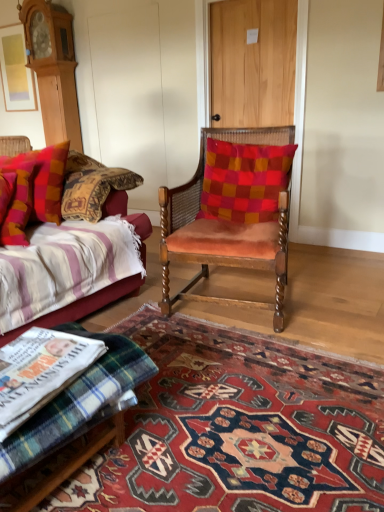
Question: Considering the relative sizes of carpet with intricate patterns at center and light brown wooden door at upper center in the image provided, is carpet with intricate patterns at center smaller than light brown wooden door at upper center?

Choices:
 (A) no
 (B) yes

Answer: (B)

Question: Does carpet with intricate patterns at center have a lesser height compared to light brown wooden door at upper center?

Choices:
 (A) yes
 (B) no

Answer: (A)

Question: Does carpet with intricate patterns at center have a greater width compared to light brown wooden door at upper center?

Choices:
 (A) no
 (B) yes

Answer: (B)

Question: Considering the relative positions of carpet with intricate patterns at center and light brown wooden door at upper center in the image provided, is carpet with intricate patterns at center to the left of light brown wooden door at upper center from the viewer's perspective?

Choices:
 (A) no
 (B) yes

Answer: (B)

Question: Is carpet with intricate patterns at center positioned far away from light brown wooden door at upper center?

Choices:
 (A) yes
 (B) no

Answer: (A)

Question: Considering the relative positions of carpet with intricate patterns at center and light brown wooden door at upper center in the image provided, is carpet with intricate patterns at center to the right of light brown wooden door at upper center from the viewer's perspective?

Choices:
 (A) no
 (B) yes

Answer: (A)

Question: Is plaid fabric pillow at left, the 3th pillow from the right, at the left side of light brown wooden door at upper center?

Choices:
 (A) yes
 (B) no

Answer: (A)

Question: Does plaid fabric pillow at left, positioned as the 1th pillow in left-to-right order, have a lesser height compared to light brown wooden door at upper center?

Choices:
 (A) yes
 (B) no

Answer: (A)

Question: Are plaid fabric pillow at left, the 3th pillow from the right, and light brown wooden door at upper center far apart?

Choices:
 (A) no
 (B) yes

Answer: (B)

Question: Does plaid fabric pillow at left, positioned as the 1th pillow in left-to-right order, have a greater width compared to light brown wooden door at upper center?

Choices:
 (A) yes
 (B) no

Answer: (A)

Question: Can you confirm if plaid fabric pillow at left, the 3th pillow from the right, is smaller than light brown wooden door at upper center?

Choices:
 (A) yes
 (B) no

Answer: (B)

Question: Is plaid fabric pillow at left, positioned as the 1th pillow in left-to-right order, to the right of light brown wooden door at upper center from the viewer's perspective?

Choices:
 (A) no
 (B) yes

Answer: (A)

Question: From a real-world perspective, is plush cotton pillow at left, the 2th pillow in the right-to-left sequence, on velvet cushion at center, placed as the 1th pillow when sorted from right to left?

Choices:
 (A) no
 (B) yes

Answer: (A)